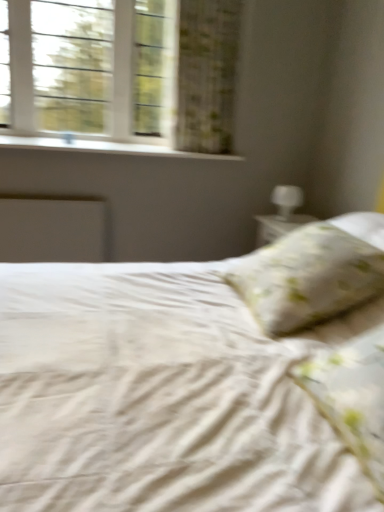
Question: From the image's perspective, is green floral fabric curtain at upper left on fluffy white pillow at right, which is the second pillow in back-to-front order?

Choices:
 (A) no
 (B) yes

Answer: (B)

Question: Is green floral fabric curtain at upper left bigger than fluffy white pillow at right, placed as the 1th pillow when sorted from front to back?

Choices:
 (A) yes
 (B) no

Answer: (A)

Question: From the image's perspective, is green floral fabric curtain at upper left beneath fluffy white pillow at right, which is the second pillow in back-to-front order?

Choices:
 (A) yes
 (B) no

Answer: (B)

Question: Can you confirm if green floral fabric curtain at upper left is smaller than fluffy white pillow at right, placed as the 1th pillow when sorted from front to back?

Choices:
 (A) yes
 (B) no

Answer: (B)

Question: Is the depth of green floral fabric curtain at upper left greater than that of fluffy white pillow at right, which is the second pillow in back-to-front order?

Choices:
 (A) no
 (B) yes

Answer: (B)

Question: Is white glossy table lamp at upper right inside the boundaries of fluffy white pillow at right, placed as the 1th pillow when sorted from front to back, or outside?

Choices:
 (A) outside
 (B) inside

Answer: (A)

Question: In the image, is white glossy table lamp at upper right positioned in front of or behind fluffy white pillow at right, which is the second pillow in back-to-front order?

Choices:
 (A) behind
 (B) front

Answer: (A)

Question: Is white glossy table lamp at upper right taller or shorter than fluffy white pillow at right, which is the second pillow in back-to-front order?

Choices:
 (A) short
 (B) tall

Answer: (A)

Question: Considering the positions of white glossy table lamp at upper right and fluffy white pillow at right, placed as the 1th pillow when sorted from front to back, in the image, is white glossy table lamp at upper right wider or thinner than fluffy white pillow at right, placed as the 1th pillow when sorted from front to back,?

Choices:
 (A) thin
 (B) wide

Answer: (A)

Question: In the image, is fluffy white pillow at right, placed as the 1th pillow when sorted from front to back, on the left side or the right side of white glossy table lamp at upper right?

Choices:
 (A) right
 (B) left

Answer: (B)

Question: Is fluffy white pillow at right, placed as the 1th pillow when sorted from front to back, in front of or behind white glossy table lamp at upper right in the image?

Choices:
 (A) behind
 (B) front

Answer: (B)

Question: From a real-world perspective, is fluffy white pillow at right, placed as the 1th pillow when sorted from front to back, positioned above or below white glossy table lamp at upper right?

Choices:
 (A) above
 (B) below

Answer: (B)

Question: Considering the positions of fluffy white pillow at right, which is the second pillow in back-to-front order, and white glossy table lamp at upper right in the image, is fluffy white pillow at right, which is the second pillow in back-to-front order, bigger or smaller than white glossy table lamp at upper right?

Choices:
 (A) big
 (B) small

Answer: (A)

Question: Would you say white glass window at upper left is to the left or to the right of white smooth window sill at upper left in the picture?

Choices:
 (A) left
 (B) right

Answer: (A)

Question: Do you think white glass window at upper left is within white smooth window sill at upper left, or outside of it?

Choices:
 (A) inside
 (B) outside

Answer: (B)